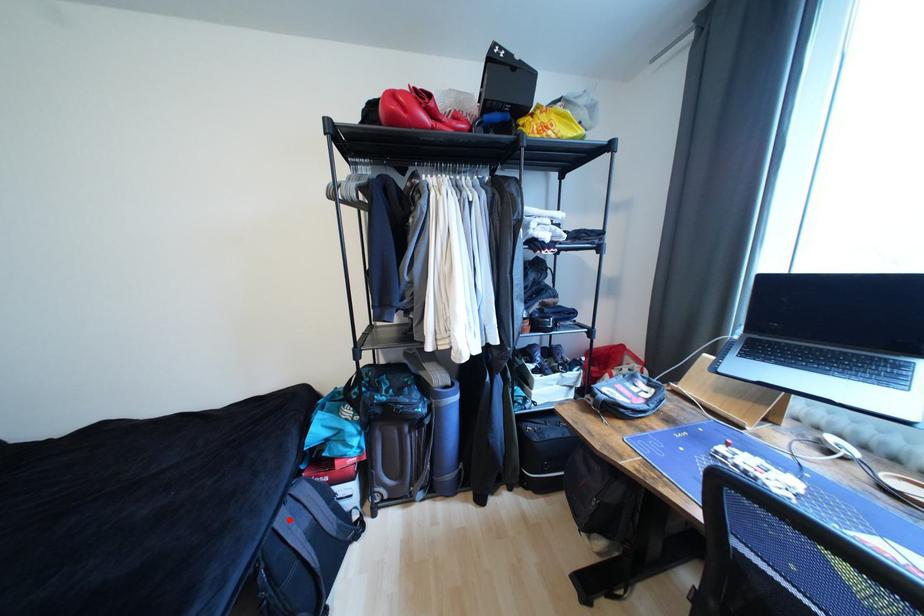
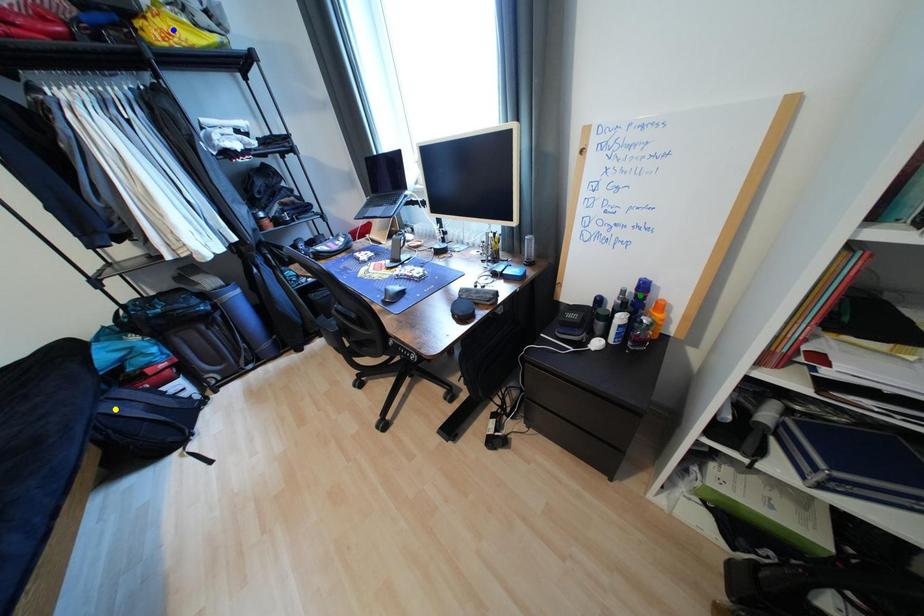
Question: I am providing you with two images of the same scene from different viewpoints. A red point is marked on the first image. You are given multiple points on the second image. Which spot in image 2 lines up with the point in image 1?

Choices:
 (A) green point
 (B) yellow point
 (C) blue point

Answer: (B)